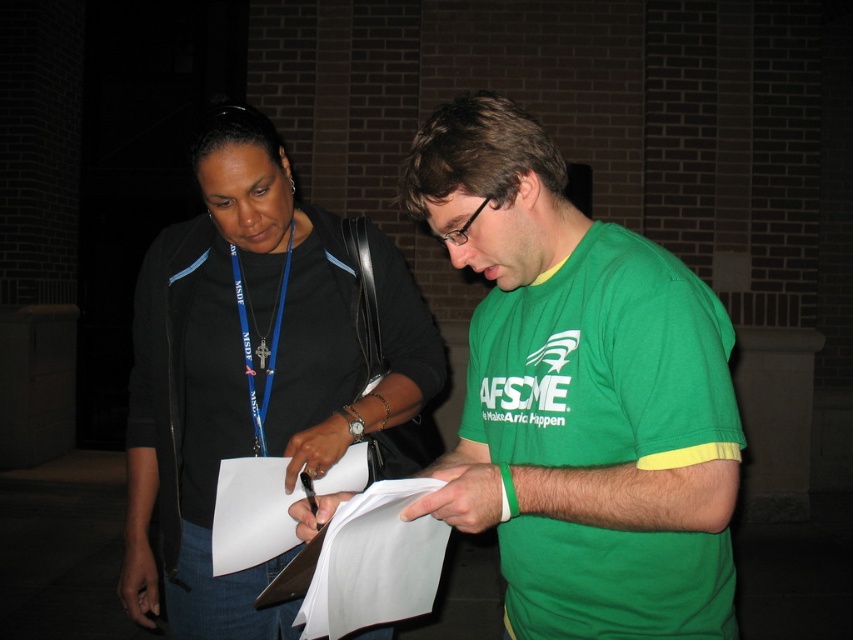
Question: From the image, what is the correct spatial relationship of green fabric shirt at center in relation to blue fabric lanyard at center?

Choices:
 (A) left
 (B) right

Answer: (B)

Question: Does black fabric shirt at center have a lesser width compared to blue fabric lanyard at center?

Choices:
 (A) no
 (B) yes

Answer: (A)

Question: Does white paper at center have a lesser width compared to blue fabric lanyard at center?

Choices:
 (A) no
 (B) yes

Answer: (A)

Question: Based on their relative distances, which object is farther from the blue fabric lanyard at center?

Choices:
 (A) black fabric shirt at center
 (B) white paper clipboard at center

Answer: (B)

Question: Which point is closer to the camera?

Choices:
 (A) (561, 356)
 (B) (288, 564)
 (C) (260, 417)
 (D) (280, 188)

Answer: (A)

Question: Which point is closer to the camera?

Choices:
 (A) coord(274,365)
 (B) coord(267,557)
 (C) coord(202,307)
 (D) coord(560,545)

Answer: (D)